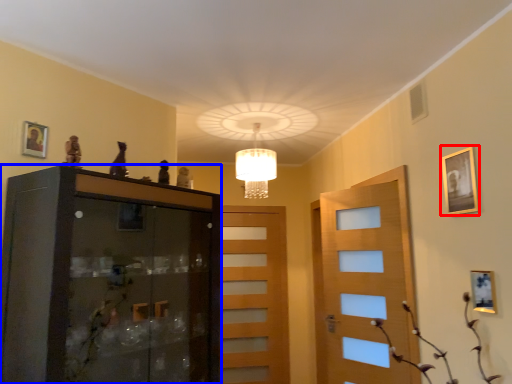
Question: Which object is further to the camera taking this photo, picture frame (highlighted by a red box) or cabinetry (highlighted by a blue box)?

Choices:
 (A) picture frame
 (B) cabinetry

Answer: (A)